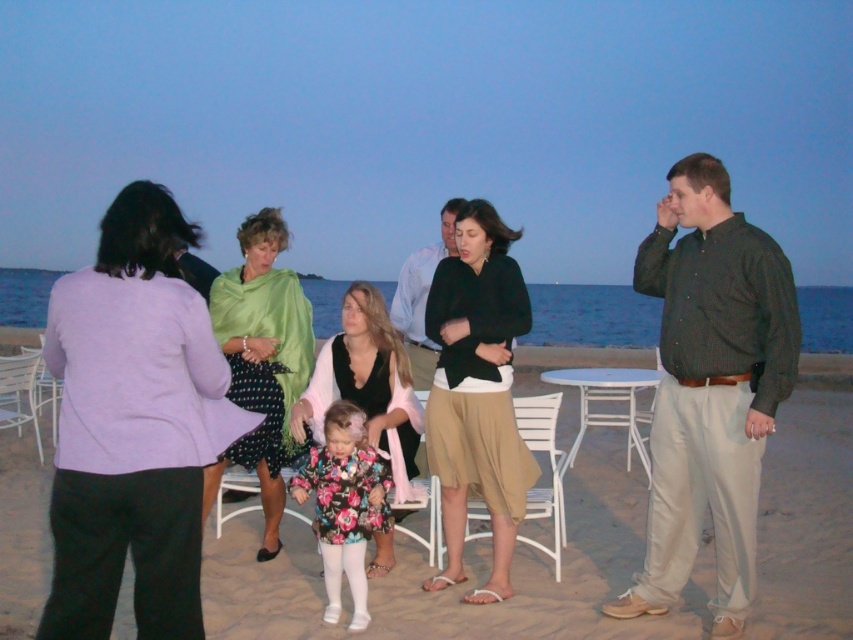
Question: Which object is farther from the camera taking this photo?

Choices:
 (A) beige sand at center
 (B) matte purple blazer at left
 (C) metallic white chair at left

Answer: (C)

Question: Which object appears farthest from the camera in this image?

Choices:
 (A) floral fabric dress at center
 (B) dark green textured shirt at right
 (C) beige sand at center
 (D) green satin shawl at center

Answer: (A)

Question: Can you confirm if dark green textured shirt at right is bigger than white plastic chair at lower left?

Choices:
 (A) yes
 (B) no

Answer: (B)

Question: Can you confirm if white plastic chair at center is thinner than white plastic chair at lower left?

Choices:
 (A) yes
 (B) no

Answer: (A)

Question: Based on their relative distances, which object is farther from the matte purple blazer at left?

Choices:
 (A) green satin shawl at center
 (B) dark green textured shirt at right
 (C) metallic white chair at left
 (D) white plastic chair at lower left

Answer: (C)

Question: Is black matte skirt at center positioned in front of floral fabric dress at center?

Choices:
 (A) yes
 (B) no

Answer: (B)